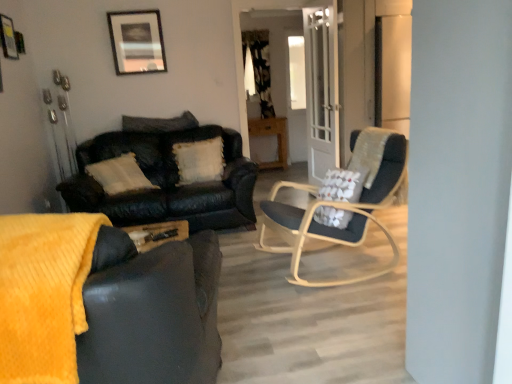
Question: Which direction should I rotate to look at white fluffy pillow at center, the second pillow in the top-to-bottom sequence, — up or down?

Choices:
 (A) up
 (B) down

Answer: (A)

Question: Is black textured curtain at upper center bigger than fluffy white pillow at center, the second pillow when ordered from bottom to top?

Choices:
 (A) yes
 (B) no

Answer: (A)

Question: Does black textured curtain at upper center contain fluffy white pillow at center, marked as the 1th pillow in a top-to-bottom arrangement?

Choices:
 (A) no
 (B) yes

Answer: (A)

Question: Is black textured curtain at upper center beside fluffy white pillow at center, the second pillow when ordered from bottom to top?

Choices:
 (A) yes
 (B) no

Answer: (B)

Question: From a real-world perspective, is black textured curtain at upper center physically above fluffy white pillow at center, marked as the 1th pillow in a top-to-bottom arrangement?

Choices:
 (A) no
 (B) yes

Answer: (B)

Question: Considering the relative sizes of black textured curtain at upper center and fluffy white pillow at center, marked as the 1th pillow in a top-to-bottom arrangement, in the image provided, is black textured curtain at upper center thinner than fluffy white pillow at center, marked as the 1th pillow in a top-to-bottom arrangement,?

Choices:
 (A) yes
 (B) no

Answer: (A)

Question: Can you confirm if black textured curtain at upper center is smaller than fluffy white pillow at center, marked as the 1th pillow in a top-to-bottom arrangement?

Choices:
 (A) no
 (B) yes

Answer: (A)

Question: From a real-world perspective, is matte black chair at center located beneath fluffy white pillow at center, the second pillow when ordered from bottom to top?

Choices:
 (A) yes
 (B) no

Answer: (A)

Question: Is matte black chair at center further to camera compared to fluffy white pillow at center, the second pillow when ordered from bottom to top?

Choices:
 (A) yes
 (B) no

Answer: (B)

Question: Does matte black chair at center have a lesser width compared to fluffy white pillow at center, the second pillow when ordered from bottom to top?

Choices:
 (A) no
 (B) yes

Answer: (A)

Question: Can you see matte black chair at center touching fluffy white pillow at center, the second pillow when ordered from bottom to top?

Choices:
 (A) yes
 (B) no

Answer: (B)

Question: Can you confirm if matte black chair at center is wider than fluffy white pillow at center, marked as the 1th pillow in a top-to-bottom arrangement?

Choices:
 (A) no
 (B) yes

Answer: (B)

Question: Can you confirm if matte black chair at center is shorter than fluffy white pillow at center, the second pillow when ordered from bottom to top?

Choices:
 (A) yes
 (B) no

Answer: (B)

Question: Does matte black chair at center appear on the right side of clear glass door at center?

Choices:
 (A) no
 (B) yes

Answer: (A)